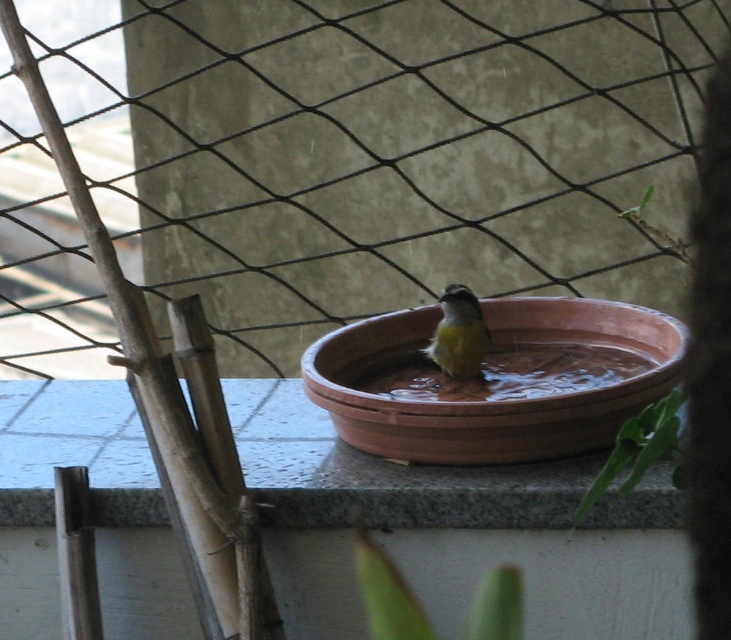
At what (x,y) coordinates should I click in order to perform the action: click on granite stone window sill at center. Please return your answer as a coordinate pair (x, y). Image resolution: width=731 pixels, height=640 pixels. Looking at the image, I should click on (382, 474).

Identify the location of granite stone window sill at center. This screenshot has width=731, height=640. (382, 474).

Is point (439, 385) farther from camera compared to point (488, 604)?

Yes, it is behind point (488, 604).

How much distance is there between clear water at center and green leafy plant at lower center?

clear water at center is 10.05 inches away from green leafy plant at lower center.

Is point (507, 381) more distant than point (503, 616)?

Yes, it is behind point (503, 616).

You are a GUI agent. You are given a task and a screenshot of the screen. Output one action in this format:
    pyautogui.click(x=<x>, y=<y>)
    Task: Click on the clear water at center
    This screenshot has width=731, height=640.
    Given the screenshot: What is the action you would take?
    pyautogui.click(x=504, y=372)

Can you confirm if granite stone window sill at center is wider than clear water at center?

Indeed, granite stone window sill at center has a greater width compared to clear water at center.

Is granite stone window sill at center shorter than clear water at center?

No.

Between point (287, 460) and point (442, 392), which one is positioned behind?

The point (442, 392) is behind.

This screenshot has height=640, width=731. Identify the location of granite stone window sill at center. (382, 474).